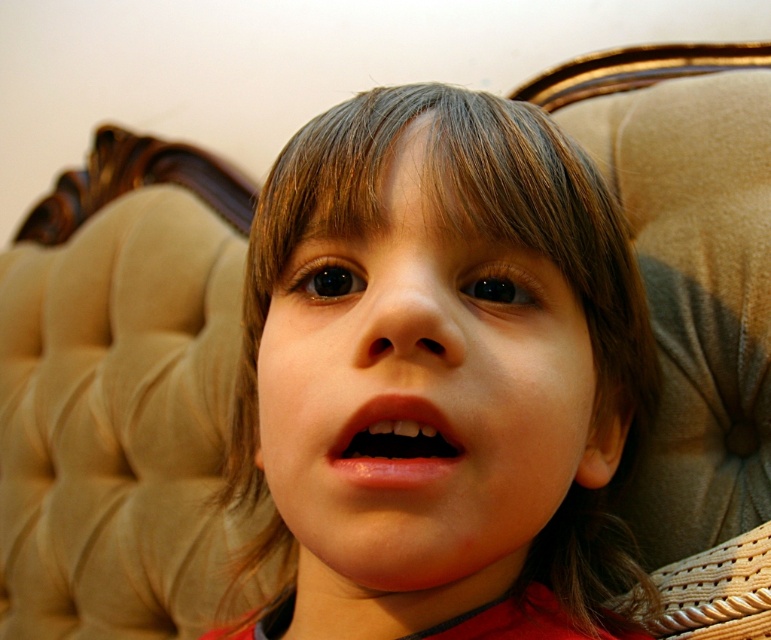
Looking at the child in the vintage armchair, how does the width of the smooth skin face at center compare to the width of the pink glossy lips at center?

The smooth skin face at center is wider than the pink glossy lips at center.

Based on the scene description, where is the smooth skin face at center located in the image?

The smooth skin face at center is located at point coordinates of approximately 0.619 on the x axis and 0.547 on the y axis.